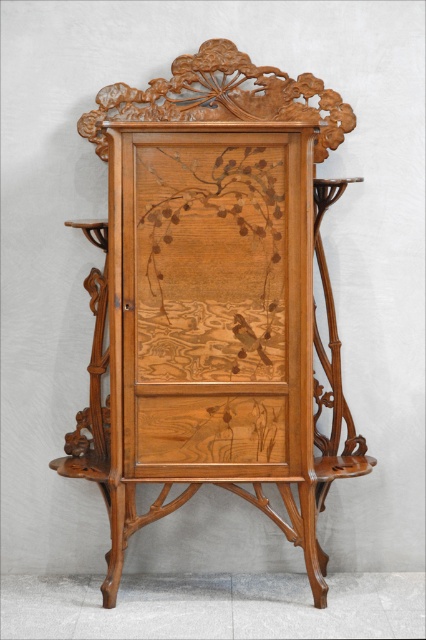
You are an interior designer trying to place a 12 inch wide decorative item on the natural wood cabinet at center. The natural wood drawer at center is nearby. Is there enough space between them to place the item?

The distance between the natural wood cabinet at center and the natural wood drawer at center is 10.13 inches. Since the decorative item is 12 inches wide, it will not fit in the space between them.

From the picture: You are an interior designer planning to place a tall floor lamp next to the natural wood cabinet at center and the natural wood drawer at center. Considering their heights, which object should the lamp be placed closer to in order to maintain visual balance?

The natural wood cabinet at center is taller than the natural wood drawer at center, so the lamp should be placed closer to the natural wood drawer at center to balance the visual weight.